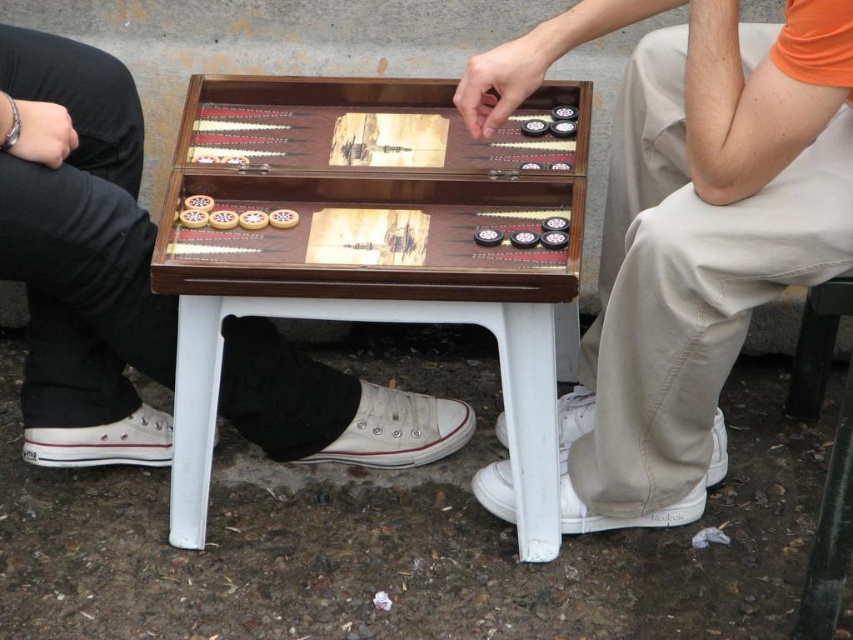
Question: Can you confirm if matte wooden backgammon board at center is smaller than white plastic stool at lower right?

Choices:
 (A) no
 (B) yes

Answer: (A)

Question: Which object is positioned closest to the matte wooden backgammon board at center?

Choices:
 (A) wooden backgammon board at center
 (B) black metal stool at lower right
 (C) white plastic stool at lower right

Answer: (A)

Question: Among these points, which one is nearest to the camera?

Choices:
 (A) (849, 512)
 (B) (28, 285)

Answer: (A)

Question: Can you confirm if wooden backgammon board at center is bigger than white canvas shoe at lower left?

Choices:
 (A) yes
 (B) no

Answer: (B)

Question: Is wooden backgammon set at center above white plastic stool at lower right?

Choices:
 (A) yes
 (B) no

Answer: (A)

Question: Which of the following is the farthest from the observer?

Choices:
 (A) black metal stool at lower right
 (B) wooden backgammon board at center
 (C) wooden backgammon set at center

Answer: (C)